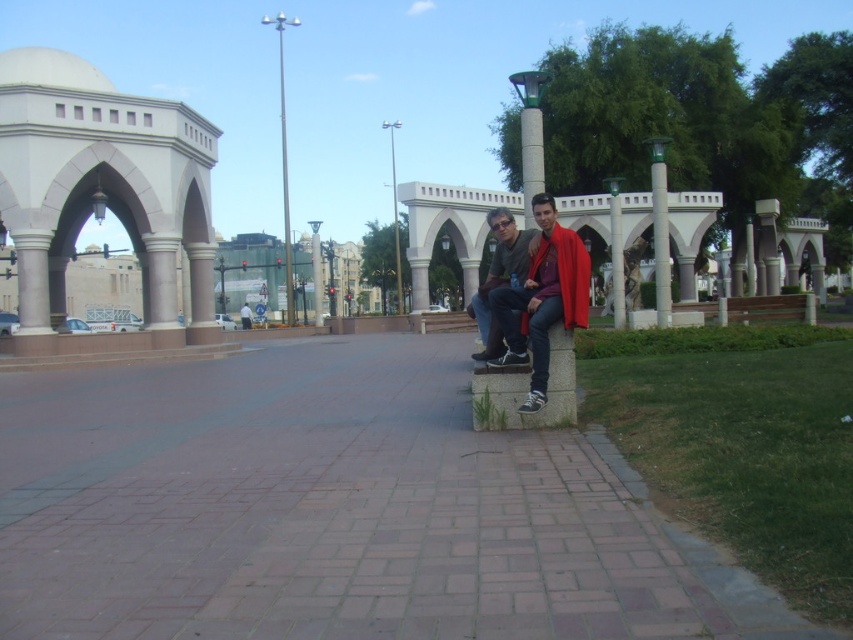
Question: Does brick pavement at center have a smaller size compared to red fabric cape at center?

Choices:
 (A) yes
 (B) no

Answer: (B)

Question: Considering the relative positions of brick pavement at center and red fabric cape at center in the image provided, where is brick pavement at center located with respect to red fabric cape at center?

Choices:
 (A) above
 (B) below

Answer: (B)

Question: Based on their relative distances, which object is nearer to the matte black jacket at center?

Choices:
 (A) brick pavement at center
 (B) red fabric cape at center

Answer: (B)

Question: Does brick pavement at center appear on the right side of red fabric cape at center?

Choices:
 (A) yes
 (B) no

Answer: (B)

Question: Which object is positioned closest to the brick pavement at center?

Choices:
 (A) matte black jacket at center
 (B) red fabric cape at center

Answer: (B)

Question: Which of these objects is positioned farthest from the matte black jacket at center?

Choices:
 (A) brick pavement at center
 (B) red fabric cape at center

Answer: (A)